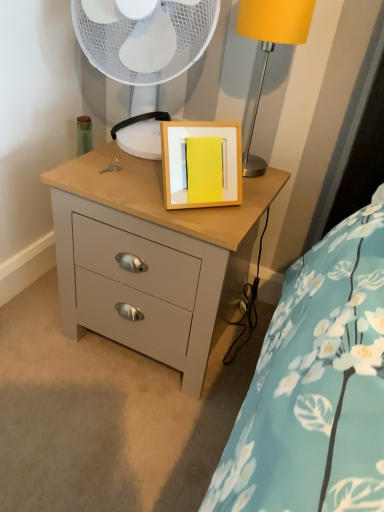
Question: From a real-world perspective, is matte yellow lampshade at upper right physically located above or below white plastic fan at upper center?

Choices:
 (A) below
 (B) above

Answer: (B)

Question: From the image's perspective, relative to white plastic fan at upper center, is matte yellow lampshade at upper right above or below?

Choices:
 (A) below
 (B) above

Answer: (A)

Question: Based on their relative distances, which object is nearer to the matte gray chest of drawers at center?

Choices:
 (A) white plastic fan at upper center
 (B) matte yellow lampshade at upper right

Answer: (A)

Question: Which is nearer to the matte gray chest of drawers at center?

Choices:
 (A) white plastic fan at upper center
 (B) matte yellow lampshade at upper right

Answer: (A)